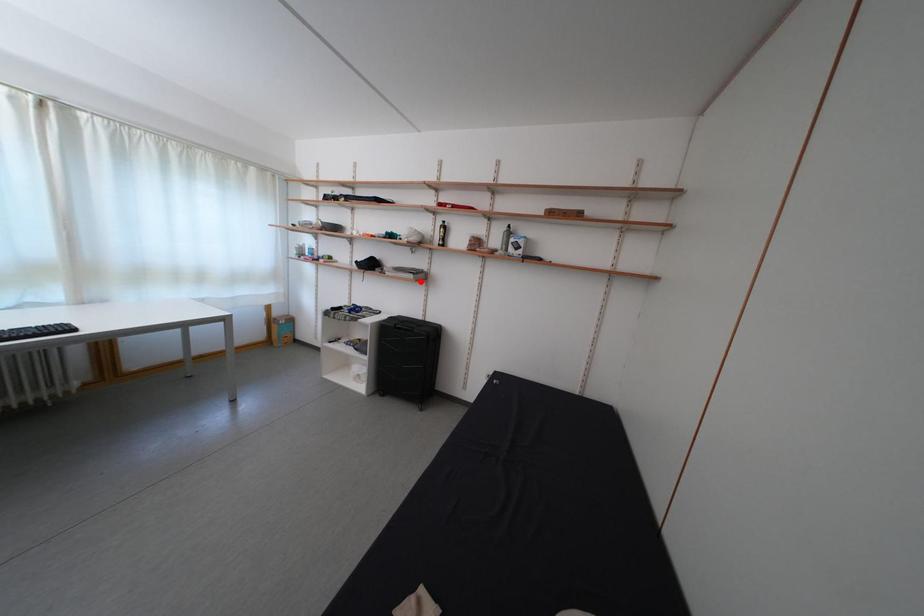
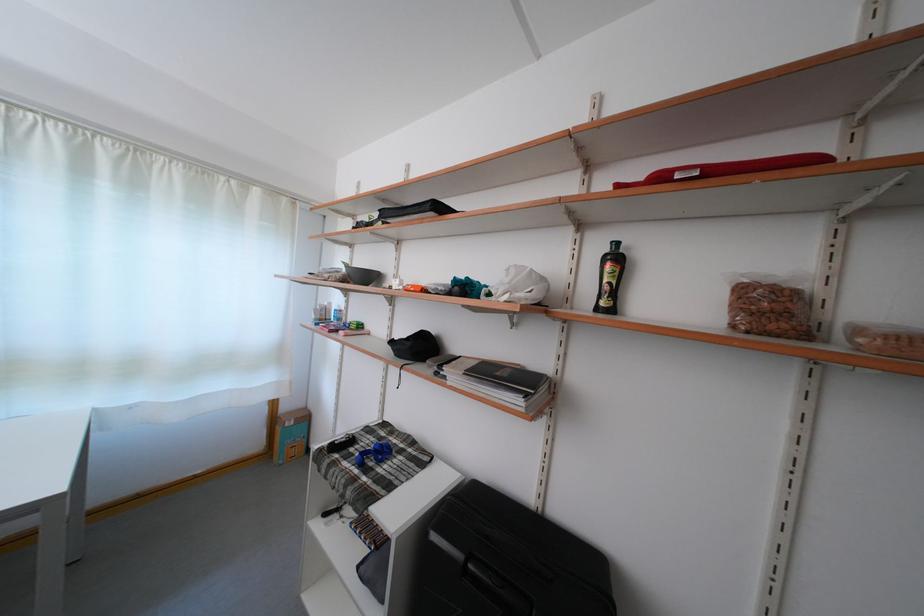
Find the pixel in the second image that matches the highlighted location in the first image.

(527, 408)